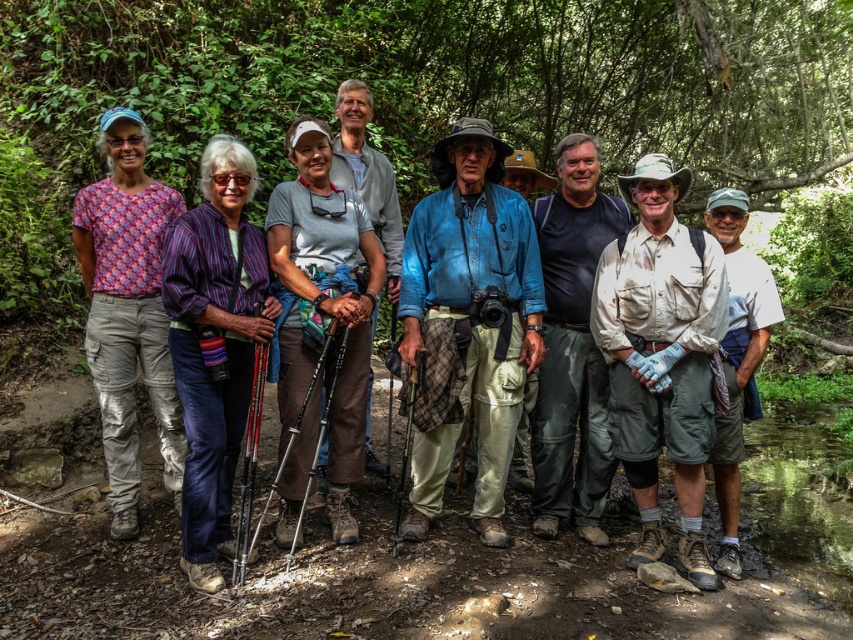
Question: Which of the following is the closest to the observer?

Choices:
 (A) (268, 259)
 (B) (509, 339)

Answer: (A)

Question: Does matte purple shirt at center appear on the right side of denim shirt at center?

Choices:
 (A) no
 (B) yes

Answer: (A)

Question: Which of the following is the farthest from the observer?

Choices:
 (A) matte purple shirt at center
 (B) denim shirt at center

Answer: (B)

Question: Does matte purple shirt at center have a larger size compared to denim shirt at center?

Choices:
 (A) yes
 (B) no

Answer: (A)

Question: Is matte purple shirt at center above denim shirt at center?

Choices:
 (A) yes
 (B) no

Answer: (B)